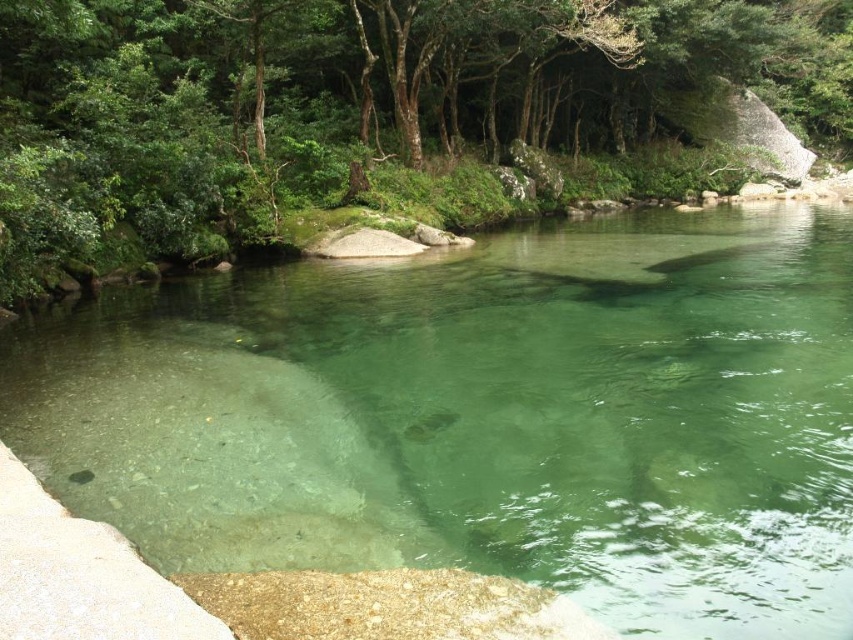
You are standing at the edge of the water and want to reach the green leafy tree at upper center. Which direction should you walk to get closer to the tree without entering the clear glassy water at center?

You should walk to the right side because the clear glassy water at center is on the left of the green leafy tree at upper center, so moving right would take you closer to the tree while avoiding the water.

You are a hiker who wants to cross the clear glassy water at center. The green leafy tree at upper center is your destination. Can you safely walk from the water to the tree without getting wet?

The clear glassy water at center is 20.61 meters away from the green leafy tree at upper center. Since the water is at the center and the tree is at upper center, you would need to walk through the water to reach the tree, which would get you wet.

You are standing at the point labeled point (550, 140) and want to walk to the point labeled point (643, 624). Which direction should you move relative to your current position?

You should move forward because point (643, 624) is in front of point (550, 140).